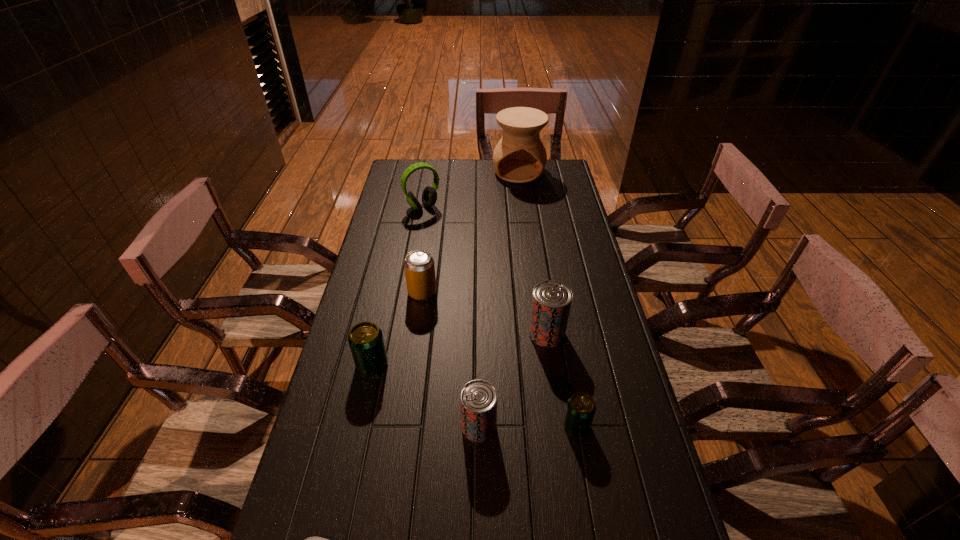
The width and height of the screenshot is (960, 540). Identify the location of the fourth object from right to left. (478, 399).

Locate an element on the screen. This screenshot has height=540, width=960. the shortest beer can is located at coordinates (581, 408).

Locate an element on the screen. The image size is (960, 540). the second shortest object is located at coordinates (581, 408).

Locate an element on the screen. The width and height of the screenshot is (960, 540). vacant region located at the open side of the farthest object is located at coordinates (527, 237).

The width and height of the screenshot is (960, 540). In order to click on vacant area situated on the front of the green headset in this screenshot , I will do [x=416, y=247].

Identify the location of free space located 0.360m on the back of the bigger red beer can. (534, 247).

Locate an element on the screen. The height and width of the screenshot is (540, 960). free space located 0.400m on the front of the sixth nearest object is located at coordinates (405, 416).

Where is `free point located on the right of the left green beer can`? free point located on the right of the left green beer can is located at coordinates (515, 364).

I want to click on vacant space located 0.090m on the left of the left red beer can, so click(424, 426).

At what (x,y) coordinates should I click in order to perform the action: click on free space located on the back of the shortest beer can. Please return your answer as a coordinate pair (x, y). Image resolution: width=960 pixels, height=540 pixels. Looking at the image, I should click on (557, 317).